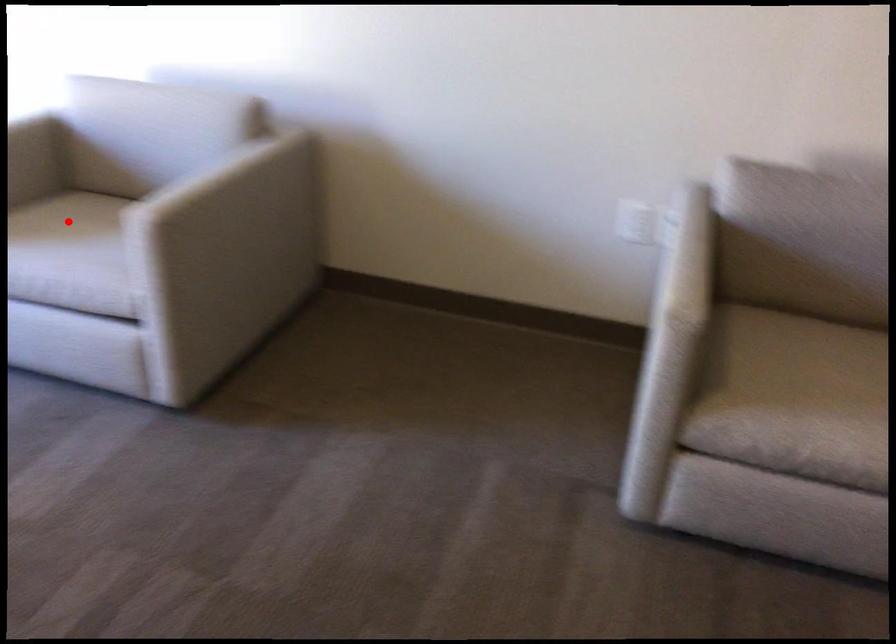
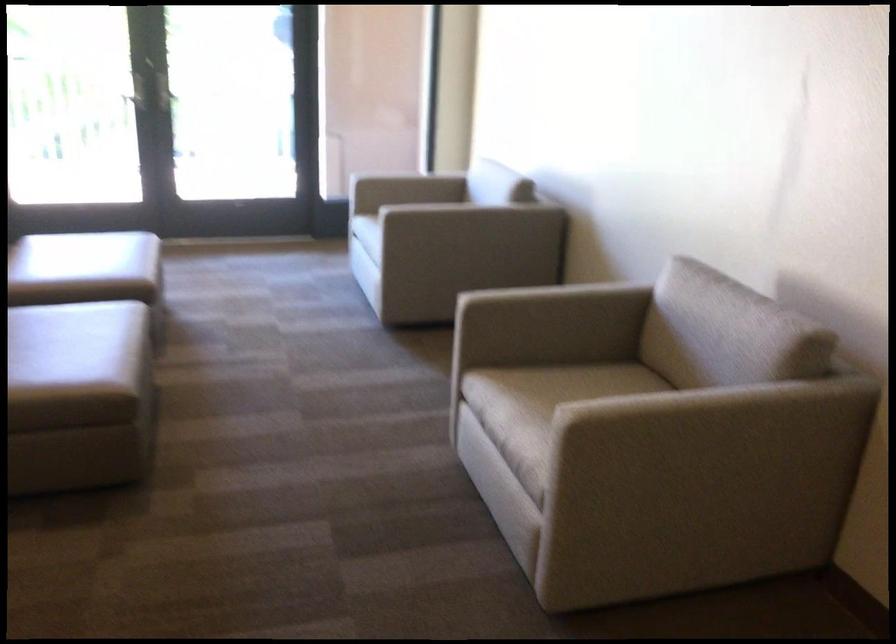
Question: I am providing you with two images of the same scene from different viewpoints. A red point is marked on the first image. Can you still see the location of the red point in image 2?

Choices:
 (A) Yes
 (B) No

Answer: (B)